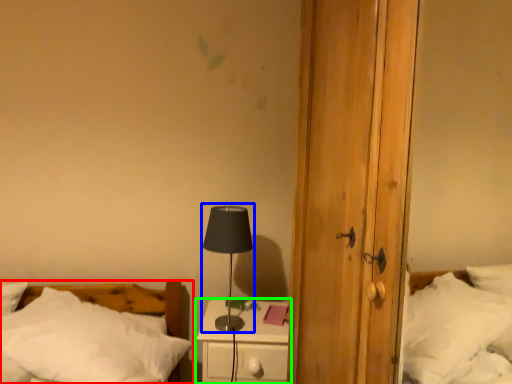
Question: Which is nearer to the bed (highlighted by a red box)? table lamp (highlighted by a blue box) or nightstand (highlighted by a green box).

Choices:
 (A) table lamp
 (B) nightstand

Answer: (B)